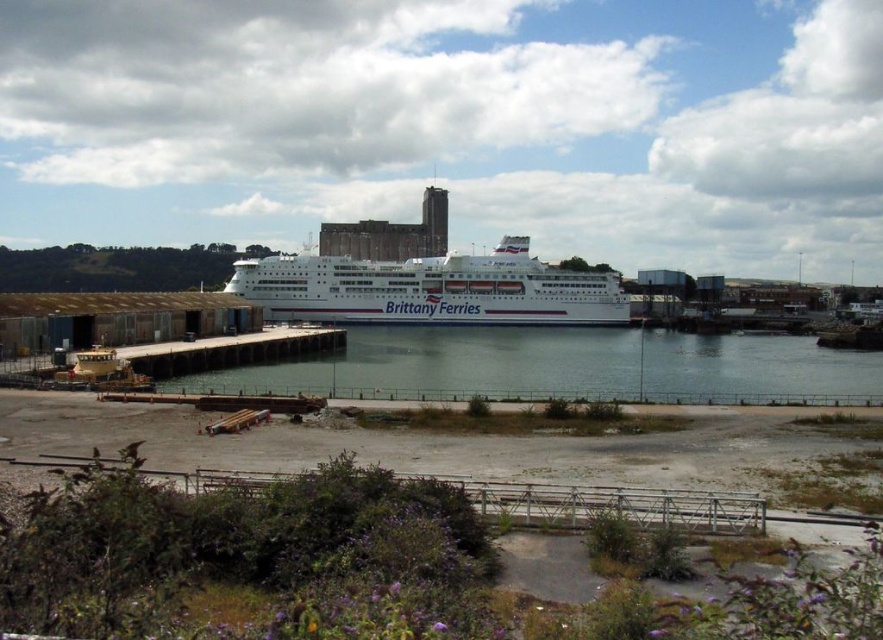
Question: Is clear water at dock center wider than white glossy cruise ship at center?

Choices:
 (A) no
 (B) yes

Answer: (B)

Question: Which point is farther from the camera taking this photo?

Choices:
 (A) (662, 333)
 (B) (442, 278)

Answer: (A)

Question: Is clear water at dock center above white glossy cruise ship at center?

Choices:
 (A) yes
 (B) no

Answer: (B)

Question: Which point is farther from the camera taking this photo?

Choices:
 (A) (861, 403)
 (B) (257, 264)

Answer: (B)

Question: Is the position of clear water at dock center less distant than that of white glossy cruise ship at center?

Choices:
 (A) yes
 (B) no

Answer: (A)